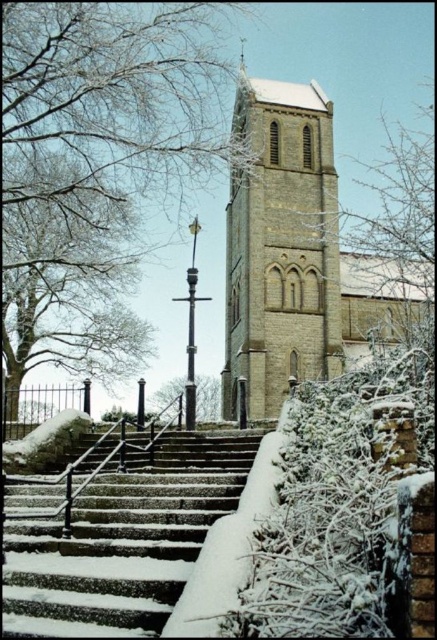
Question: Does beige stone church at center have a greater width compared to snow-covered stone stairs at center?

Choices:
 (A) yes
 (B) no

Answer: (A)

Question: Among these points, which one is nearest to the camera?

Choices:
 (A) (297, 182)
 (B) (24, 486)

Answer: (B)

Question: Which point is closer to the camera taking this photo?

Choices:
 (A) (305, 264)
 (B) (181, 486)

Answer: (B)

Question: Does beige stone church at center have a smaller size compared to snow-covered stone stairs at center?

Choices:
 (A) no
 (B) yes

Answer: (A)

Question: Is beige stone church at center above snow-covered stone stairs at center?

Choices:
 (A) yes
 (B) no

Answer: (A)